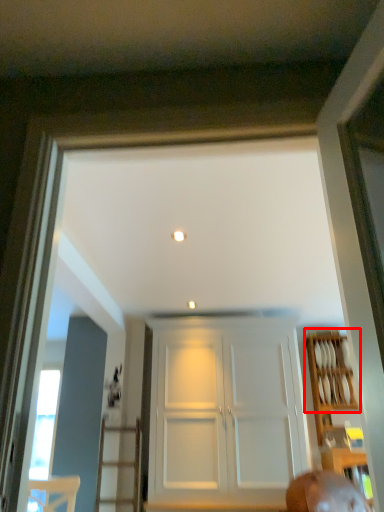
Question: From the image's perspective, where is shelf (annotated by the red box) located relative to door?

Choices:
 (A) above
 (B) below

Answer: (A)